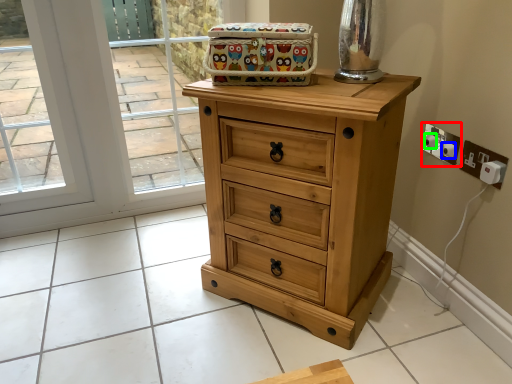
Question: Considering the real-world distances, which object is farthest from electric outlet (highlighted by a red box)? knob (highlighted by a blue box) or knob (highlighted by a green box)?

Choices:
 (A) knob
 (B) knob

Answer: (A)